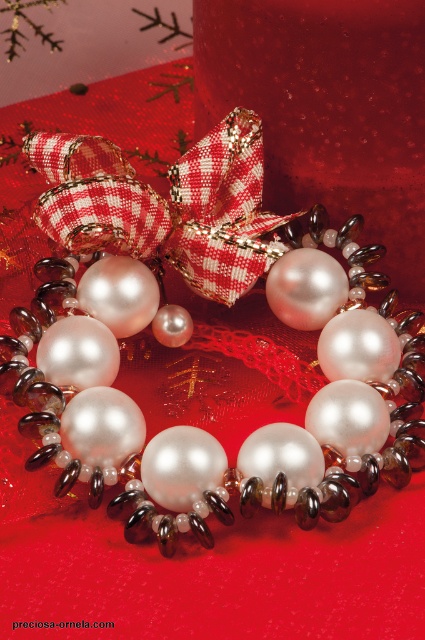
You are a jeweler examining a holiday display. There is a point marked at coordinates [189,337]. What item is located at this point?

The point at coordinates [189,337] corresponds to the pearl or resin necklace at center.